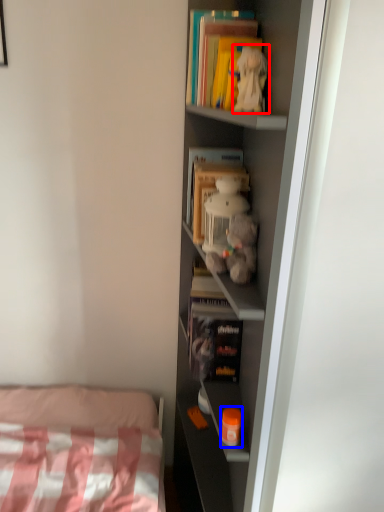
Question: Which point is closer to the camera, toy (highlighted by a red box) or toy (highlighted by a blue box)?

Choices:
 (A) toy
 (B) toy

Answer: (A)